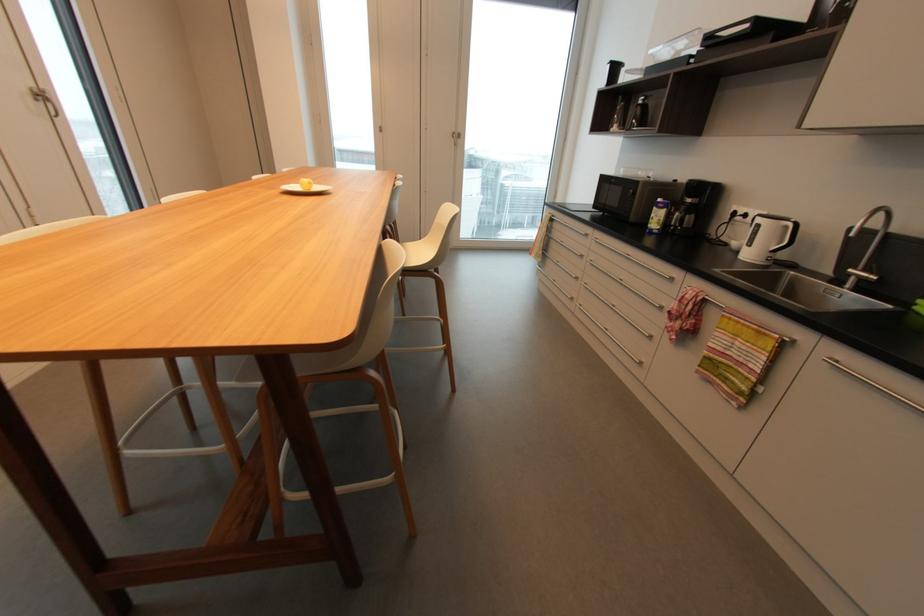
Find where to pull the metal window handle. Please return your answer as a coordinate pair (x, y).

(50, 105)